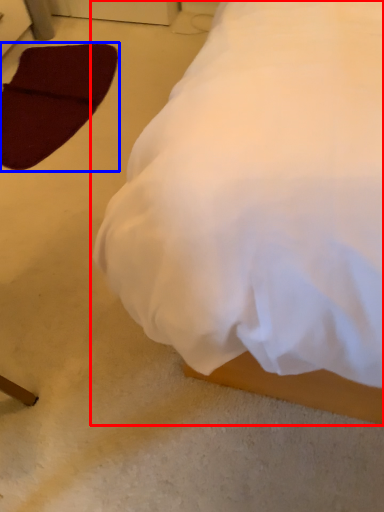
Question: Which object is further to the camera taking this photo, bed (highlighted by a red box) or pad (highlighted by a blue box)?

Choices:
 (A) bed
 (B) pad

Answer: (B)